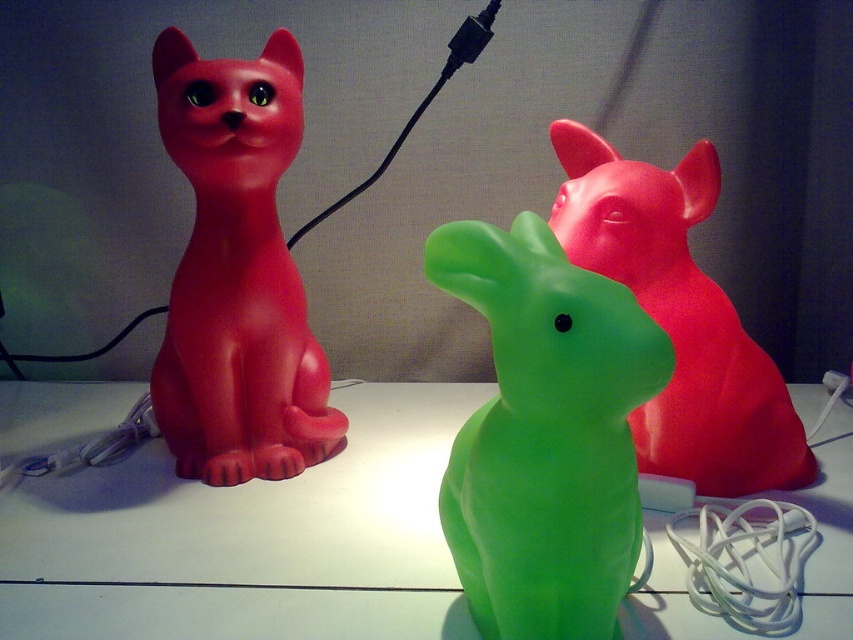
Question: Does green translucent cat at center have a larger size compared to glossy plastic cat at upper right?

Choices:
 (A) no
 (B) yes

Answer: (B)

Question: Based on their relative distances, which object is nearer to the glossy plastic cat at upper right?

Choices:
 (A) green translucent cat at center
 (B) green translucent rabbit at center
 (C) matte plastic cat at left

Answer: (B)

Question: Which object appears closest to the camera in this image?

Choices:
 (A) glossy plastic cat at upper right
 (B) matte plastic cat at left
 (C) green translucent cat at center

Answer: (C)

Question: Is matte plastic cat at left closer to camera compared to glossy plastic cat at upper right?

Choices:
 (A) yes
 (B) no

Answer: (B)

Question: Which of these objects is positioned closest to the matte plastic cat at left?

Choices:
 (A) green translucent cat at center
 (B) glossy plastic cat at upper right

Answer: (A)

Question: Can you confirm if green translucent cat at center is positioned to the right of green translucent rabbit at center?

Choices:
 (A) yes
 (B) no

Answer: (B)